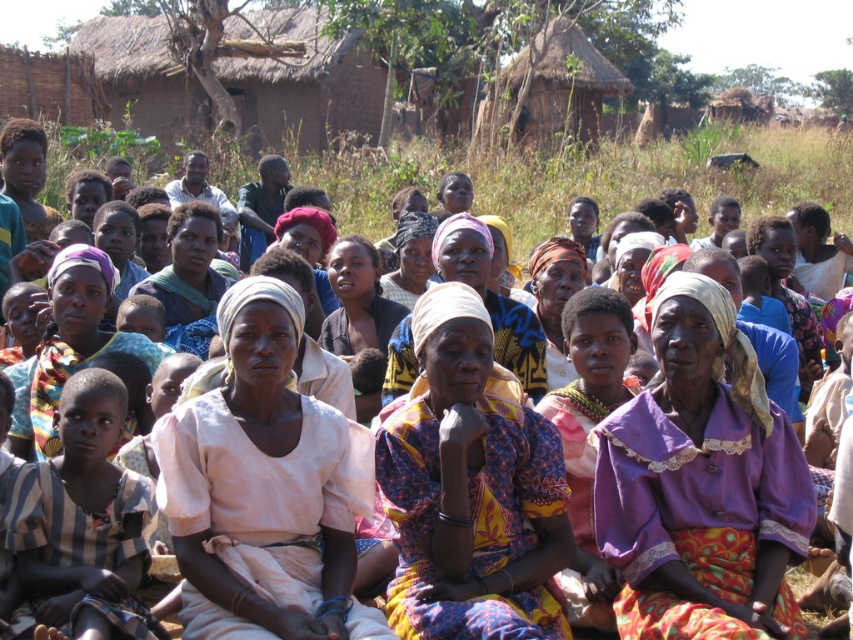
Can you confirm if printed fabric dress at center is positioned to the left of purple fabric headscarf at center?

Incorrect, printed fabric dress at center is not on the left side of purple fabric headscarf at center.

Identify the location of printed fabric dress at center. The height and width of the screenshot is (640, 853). (469, 486).

Describe the element at coordinates (469, 486) in the screenshot. I see `printed fabric dress at center` at that location.

Locate an element on the screen. This screenshot has width=853, height=640. printed fabric dress at center is located at coordinates (469, 486).

Is pink fabric at center smaller than multicolored fabric headscarf at center?

Incorrect, pink fabric at center is not smaller in size than multicolored fabric headscarf at center.

Does pink fabric at center have a greater height compared to multicolored fabric headscarf at center?

Indeed, pink fabric at center has a greater height compared to multicolored fabric headscarf at center.

Where is `pink fabric at center`? pink fabric at center is located at coordinates (265, 488).

Does point (518, 564) come in front of point (489, 307)?

Yes, point (518, 564) is in front of point (489, 307).

Between point (543, 547) and point (392, 340), which one is positioned in front?

Positioned in front is point (543, 547).

The width and height of the screenshot is (853, 640). Find the location of `printed fabric dress at center`. printed fabric dress at center is located at coordinates (469, 486).